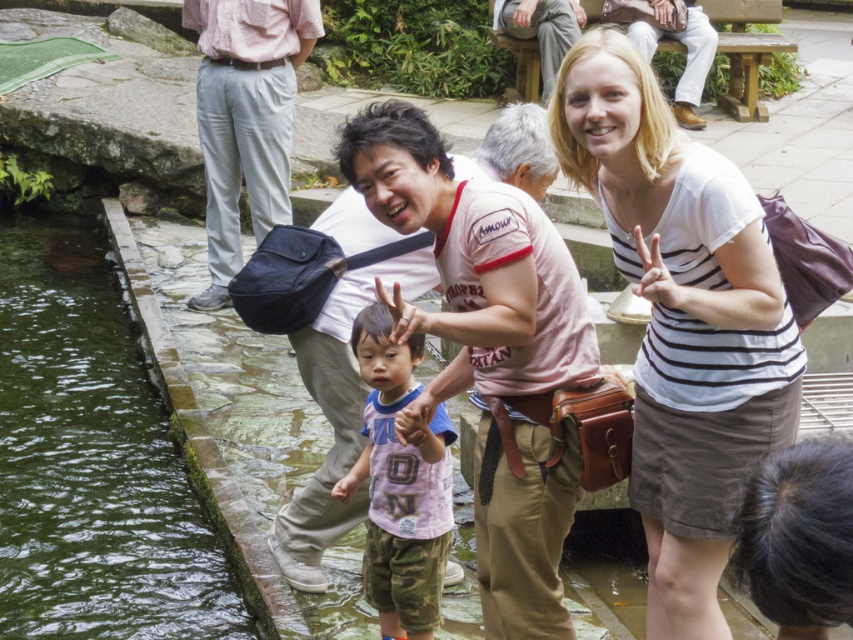
What are the coordinates of the pink cotton shirt at center in the image?

The coordinates of the pink cotton shirt at center are at point (x=473, y=268).